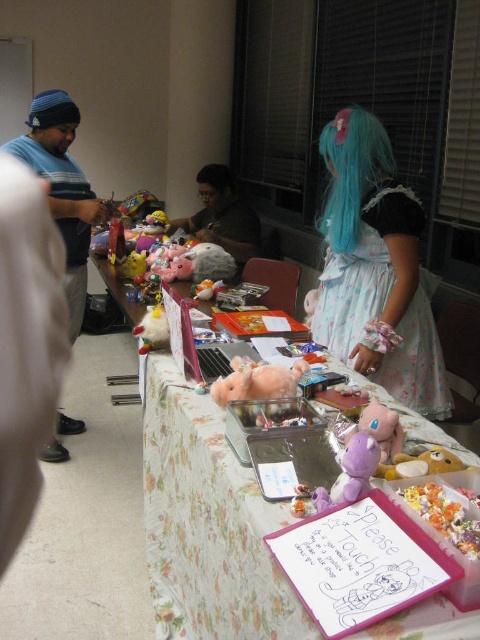
Can you confirm if blue silky wig at upper center is positioned below purple plush toy at center?

Incorrect, blue silky wig at upper center is not positioned below purple plush toy at center.

How far apart are blue silky wig at upper center and purple plush toy at center?

blue silky wig at upper center is 3.89 feet away from purple plush toy at center.

At what (x,y) coordinates should I click in order to perform the action: click on blue silky wig at upper center. Please return your answer as a coordinate pair (x, y). This screenshot has width=480, height=640. Looking at the image, I should click on (351, 172).

Can you confirm if blue hair at center is thinner than purple plush toy at center?

In fact, blue hair at center might be wider than purple plush toy at center.

Does blue hair at center have a smaller size compared to purple plush toy at center?

No.

You are a GUI agent. You are given a task and a screenshot of the screen. Output one action in this format:
    pyautogui.click(x=<x>, y=<y>)
    Task: Click on the blue hair at center
    The height and width of the screenshot is (640, 480).
    Given the screenshot: What is the action you would take?
    pyautogui.click(x=375, y=269)

Between fluffy pink stuffed animal at center and purple plush toy at center, which one appears on the left side from the viewer's perspective?

From the viewer's perspective, fluffy pink stuffed animal at center appears more on the left side.

Is point (240, 362) positioned before point (348, 461)?

No, it is not.

This screenshot has height=640, width=480. Describe the element at coordinates (257, 381) in the screenshot. I see `fluffy pink stuffed animal at center` at that location.

This screenshot has width=480, height=640. What are the coordinates of `fluffy pink stuffed animal at center` in the screenshot? It's located at (257, 381).